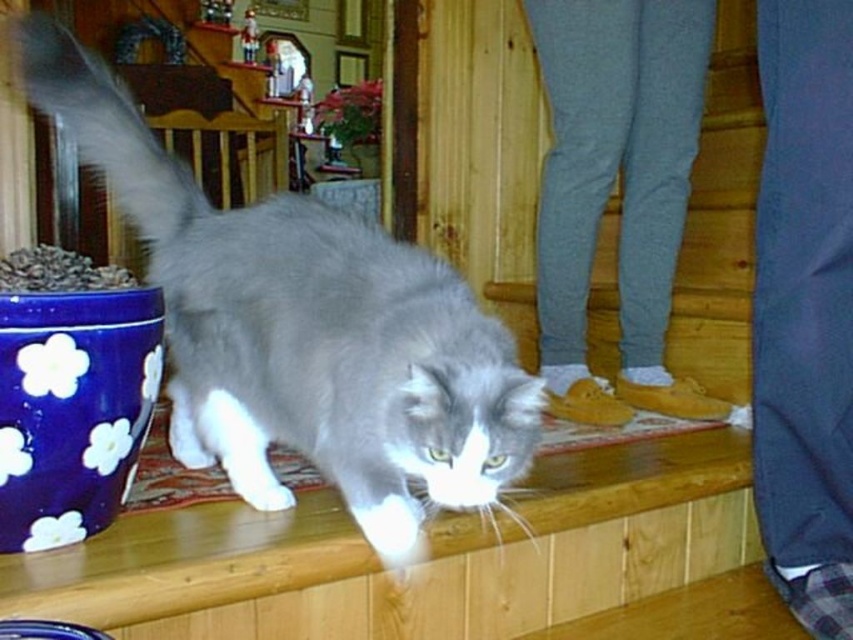
Question: Is gray fluffy cat at center to the left of fluffy white tail at upper left from the viewer's perspective?

Choices:
 (A) yes
 (B) no

Answer: (B)

Question: Considering the real-world distances, which object is closest to the gray fabric stairs at center?

Choices:
 (A) gray fluffy cat at center
 (B) blue matte flower pot at left
 (C) dark blue fabric pants at lower right
 (D) fluffy white tail at upper left

Answer: (C)

Question: Can you confirm if fluffy white tail at upper left is wider than blue matte flower pot at left?

Choices:
 (A) no
 (B) yes

Answer: (B)

Question: Which point is closer to the camera taking this photo?

Choices:
 (A) (674, 164)
 (B) (664, 564)

Answer: (B)

Question: Is wooden ledge at center below gray fabric stairs at center?

Choices:
 (A) no
 (B) yes

Answer: (B)

Question: Which point is closer to the camera taking this photo?

Choices:
 (A) (100, 269)
 (B) (755, 374)
 (C) (154, 580)

Answer: (C)